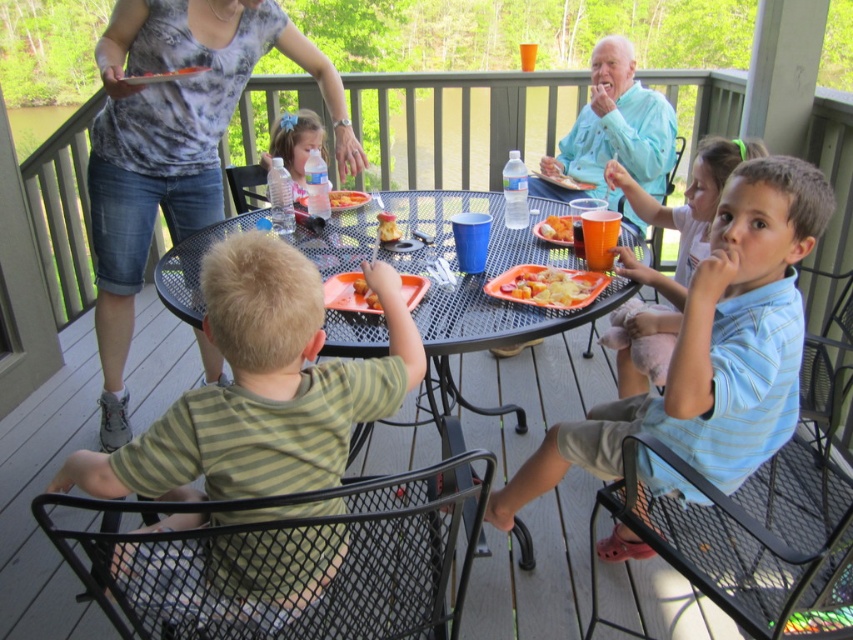
You are a parent at this family gathering and want to give your child a drink. Which item at center is bigger, the matte plastic water bottle at center or the golden crispy chicken at center?

The matte plastic water bottle at center has a larger size compared to the golden crispy chicken at center, so the water bottle is bigger.

You are a photographer trying to capture a closeup of the blue striped shirt at center and the black mesh table at center. The camera lens can only focus on objects that are at least 10 cm thick. Will both objects meet the thickness requirement?

The blue striped shirt at center is thinner than the black mesh table at center. Since the blue striped shirt at center is thinner than the required 10 cm thickness, it may not meet the camera lens requirement. The black mesh table at center is thicker and likely meets the requirement.